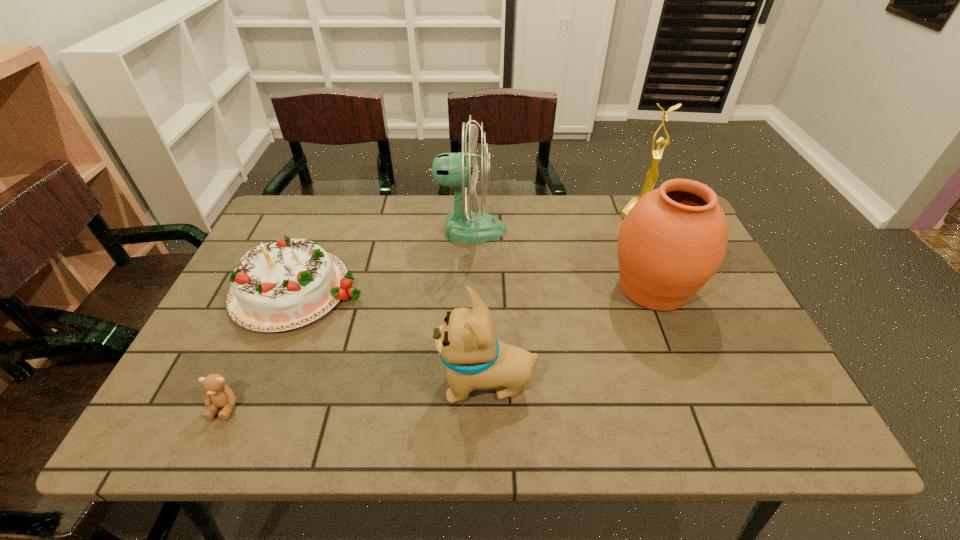
The width and height of the screenshot is (960, 540). Identify the location of unoccupied area between the award and the cake. (469, 251).

You are a GUI agent. You are given a task and a screenshot of the screen. Output one action in this format:
    pyautogui.click(x=<x>, y=<y>)
    Task: Click on the free spot between the second shortest object and the fan
    The image size is (960, 540).
    Given the screenshot: What is the action you would take?
    coord(385,259)

This screenshot has height=540, width=960. Identify the location of empty location between the fan and the shortest object. (348, 318).

The height and width of the screenshot is (540, 960). I want to click on unoccupied area between the third shortest object and the cake, so click(394, 335).

Find the location of a particular element. This screenshot has width=960, height=540. unoccupied area between the puppy and the shortest object is located at coordinates (356, 395).

Locate an element on the screen. The image size is (960, 540). object that is the second closest to the third tallest object is located at coordinates (475, 360).

This screenshot has height=540, width=960. Find the location of `object that is the third nearest to the cake`. object that is the third nearest to the cake is located at coordinates (475, 360).

Locate an element on the screen. free space in the image that satisfies the following two spatial constraints: 1. on the face of the puppy; 2. on the face of the shortest object is located at coordinates (487, 407).

Identify the location of free location that satisfies the following two spatial constraints: 1. on the front-facing side of the award; 2. in front of the fan, directing airflow. (647, 230).

You are a GUI agent. You are given a task and a screenshot of the screen. Output one action in this format:
    pyautogui.click(x=<x>, y=<y>)
    Task: Click on the vacant area in the image that satisfies the following two spatial constraints: 1. in front of the fan, directing airflow; 2. on the back side of the third tallest object
    
    Given the screenshot: What is the action you would take?
    pyautogui.click(x=468, y=287)